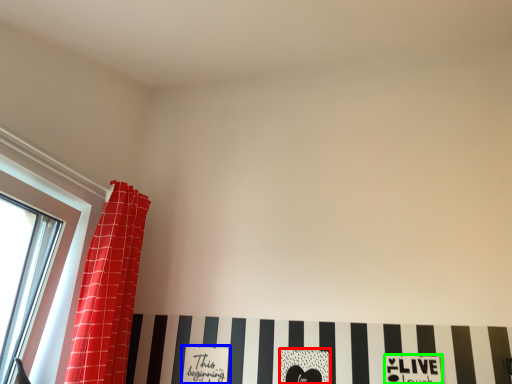
Question: Considering the real-world distances, which object is farthest from print (highlighted by a red box)? print (highlighted by a blue box) or print (highlighted by a green box)?

Choices:
 (A) print
 (B) print

Answer: (A)